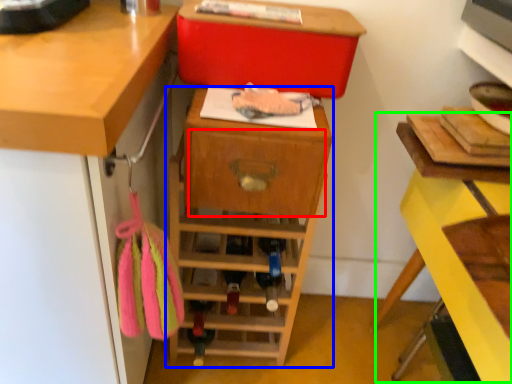
Question: Based on their relative distances, which object is farther from drawer (highlighted by a red box)? Choose from shelf (highlighted by a blue box) and computer desk (highlighted by a green box).

Choices:
 (A) shelf
 (B) computer desk

Answer: (B)